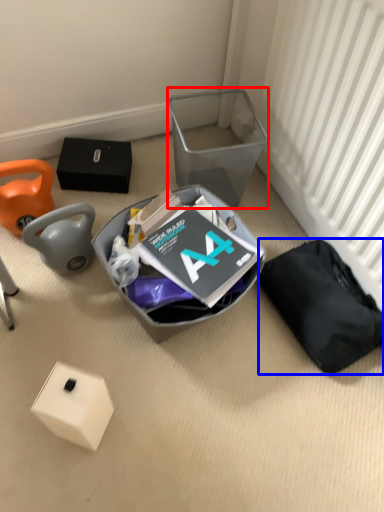
Question: Which object appears farthest to the camera in this image, shoe box (highlighted by a red box) or waste (highlighted by a blue box)?

Choices:
 (A) shoe box
 (B) waste

Answer: (A)